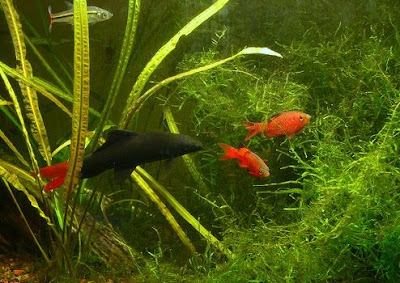
Identify the location of aquarium. The image size is (400, 283). (183, 176).